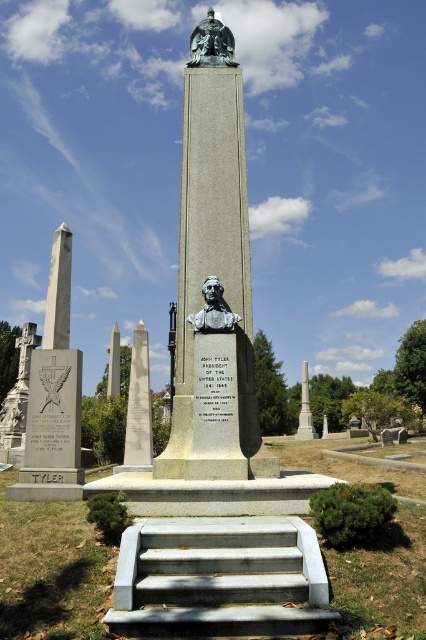
You are visiting the memorial and want to take a photo of both the bronze statue at center and the bronze statue at upper center. Which statue should you focus on first to ensure both are in the frame?

You should focus on the bronze statue at center first since it is positioned under the bronze statue at upper center, ensuring both are visible in the frame when centered.

You are a tour guide explaining the memorial to visitors. You mention both the bronze statue at center and the bronze statue at upper center. Which statue is wider?

The bronze statue at center is wider than the bronze statue at upper center.

You are visiting the memorial and want to take a photo of the bronze statue at upper center from the bottom of the gray concrete stairs at center. Considering their heights, will the statue be fully visible in your photo without any obstruction?

The gray concrete stairs at center has a lesser height compared to bronze statue at upper center, so the statue will be fully visible in your photo without any obstruction because the stairs are shorter and won